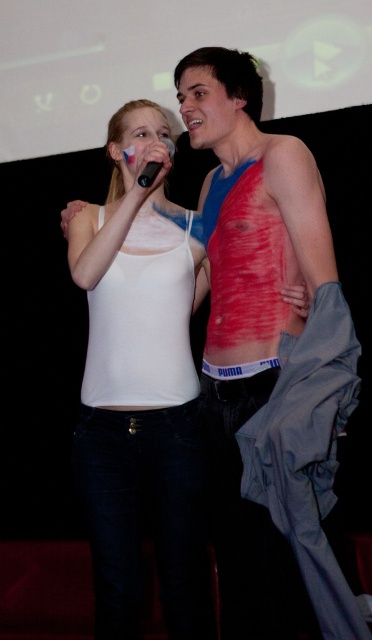
You are a stagehand adjusting the lighting for the performance. You need to place a spotlight on the closer of the two points between point (130,276) and point (171,145). Which point should you choose?

Point (130,276) is closer to the viewer than point (171,145), so you should place the spotlight on point (130,276).

You are a photographer trying to capture the white matte tank top at center in the image. The tank top is exactly at point (139, 392). Your camera has a focus range of 0.5 to 0.7 on both axes. Will the white matte tank top at center be in focus?

The white matte tank top at center is located at point (139, 392). Since both coordinates fall within the camera focus range of 0.5 to 0.7 on both axes, the white matte tank top at center will be in focus.